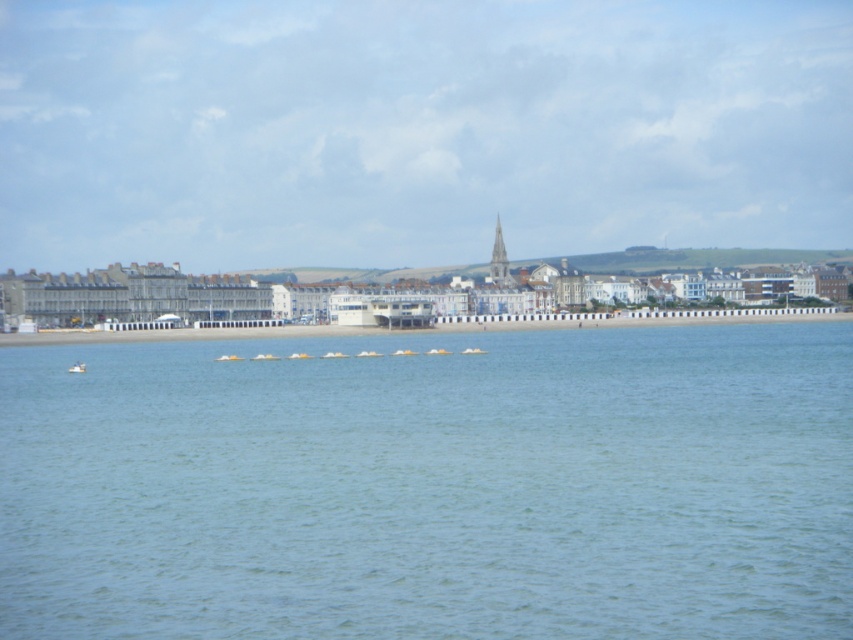
Question: Is smooth white spire at center closer to camera compared to white plastic boat at lower left?

Choices:
 (A) yes
 (B) no

Answer: (B)

Question: Which object appears closest to the camera in this image?

Choices:
 (A) white sand at center
 (B) clear blue water at center
 (C) white plastic boat at lower left
 (D) smooth white spire at center

Answer: (B)

Question: Is clear blue water at center positioned behind white sand at center?

Choices:
 (A) no
 (B) yes

Answer: (A)

Question: Among these points, which one is nearest to the camera?

Choices:
 (A) tap(71, 365)
 (B) tap(503, 284)
 (C) tap(621, 442)
 (D) tap(27, 337)

Answer: (C)

Question: Which of the following is the farthest from the observer?

Choices:
 (A) white plastic boat at lower left
 (B) smooth white spire at center
 (C) clear blue water at center

Answer: (B)

Question: Observing the image, what is the correct spatial positioning of clear blue water at center in reference to smooth white spire at center?

Choices:
 (A) below
 (B) above

Answer: (A)